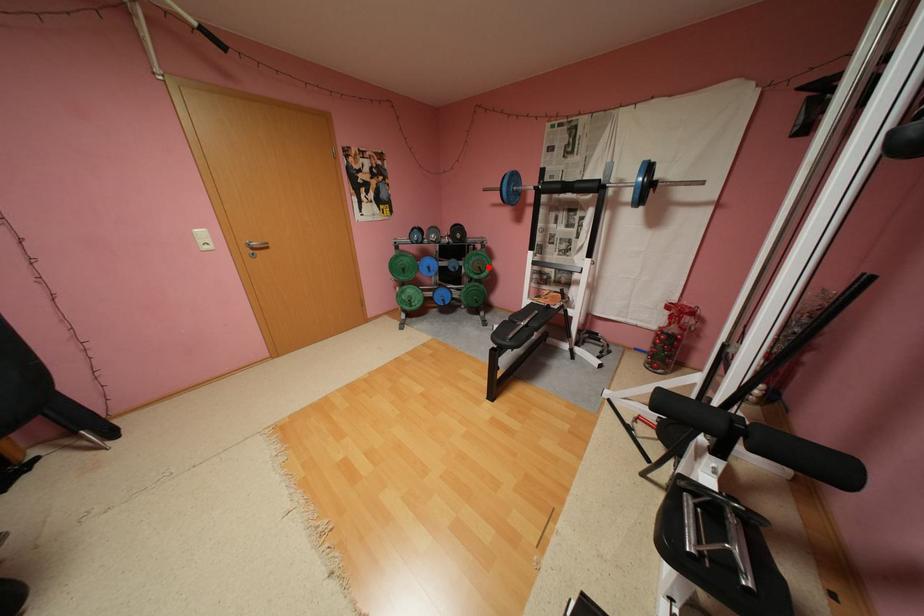
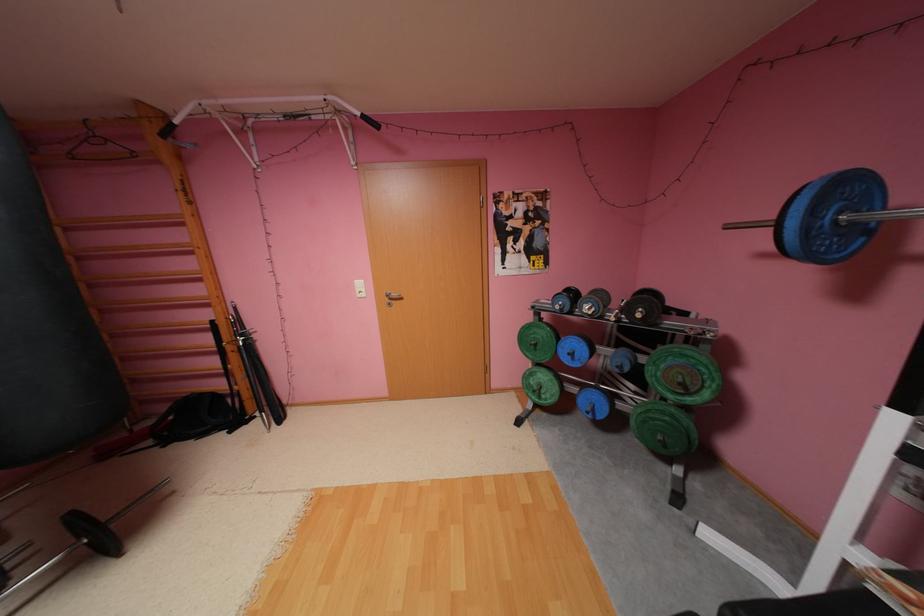
Question: I am providing you with two images of the same scene from different viewpoints. Given a red point in image1, look at the same physical point in image2. Is it:

Choices:
 (A) Closer to the viewpoint
 (B) Farther from the viewpoint

Answer: (B)